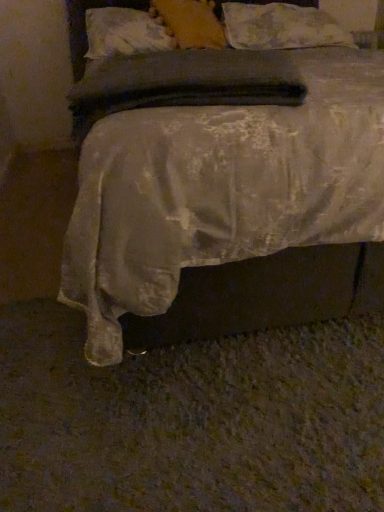
Question: Which direction should I rotate to look at soft yellow pillow at upper center, which is the 2th pillow in left-to-right order?

Choices:
 (A) left
 (B) right

Answer: (B)

Question: From the image's perspective, is silky white bed at center beneath white textured pillow at upper center, arranged as the first pillow when viewed from the left?

Choices:
 (A) no
 (B) yes

Answer: (B)

Question: Are silky white bed at center and white textured pillow at upper center, arranged as the first pillow when viewed from the left, far apart?

Choices:
 (A) no
 (B) yes

Answer: (B)

Question: Does silky white bed at center lie in front of white textured pillow at upper center, arranged as the first pillow when viewed from the left?

Choices:
 (A) no
 (B) yes

Answer: (B)

Question: Is silky white bed at center completely or partially outside of white textured pillow at upper center, which is counted as the third pillow, starting from the right?

Choices:
 (A) yes
 (B) no

Answer: (A)

Question: Is silky white bed at center at the left side of white textured pillow at upper center, arranged as the first pillow when viewed from the left?

Choices:
 (A) no
 (B) yes

Answer: (A)

Question: Is silky white bed at center directly adjacent to white textured pillow at upper center, which is counted as the third pillow, starting from the right?

Choices:
 (A) no
 (B) yes

Answer: (A)

Question: Is silky white bed at center at the back of white textured pillow at upper center, which is counted as the third pillow, starting from the right?

Choices:
 (A) no
 (B) yes

Answer: (B)

Question: From a real-world perspective, is white textured pillow at upper center, arranged as the first pillow when viewed from the left, positioned over silky white bed at center based on gravity?

Choices:
 (A) no
 (B) yes

Answer: (B)

Question: Considering the relative sizes of white textured pillow at upper center, arranged as the first pillow when viewed from the left, and silky white bed at center in the image provided, is white textured pillow at upper center, arranged as the first pillow when viewed from the left, bigger than silky white bed at center?

Choices:
 (A) yes
 (B) no

Answer: (B)

Question: Is white textured pillow at upper center, which is counted as the third pillow, starting from the right, positioned far away from silky white bed at center?

Choices:
 (A) no
 (B) yes

Answer: (B)

Question: From a real-world perspective, is white textured pillow at upper center, which is counted as the third pillow, starting from the right, below silky white bed at center?

Choices:
 (A) yes
 (B) no

Answer: (B)

Question: Is white textured pillow at upper center, arranged as the first pillow when viewed from the left, positioned beyond the bounds of silky white bed at center?

Choices:
 (A) yes
 (B) no

Answer: (B)

Question: From a real-world perspective, is fluffy white pillow at upper center, which is the third pillow from left to right, positioned over soft yellow pillow at upper center, placed as the 2th pillow when sorted from right to left, based on gravity?

Choices:
 (A) no
 (B) yes

Answer: (A)